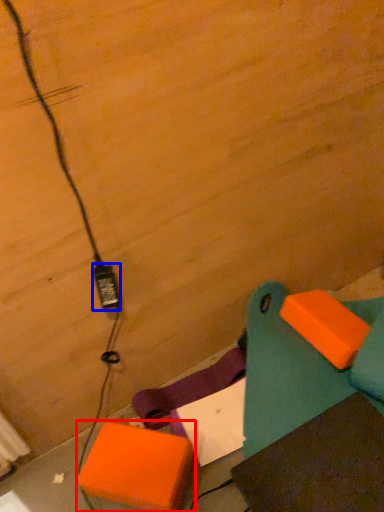
Question: Which object is further to the camera taking this photo, cardboard box (highlighted by a red box) or power plugs and sockets (highlighted by a blue box)?

Choices:
 (A) cardboard box
 (B) power plugs and sockets

Answer: (A)